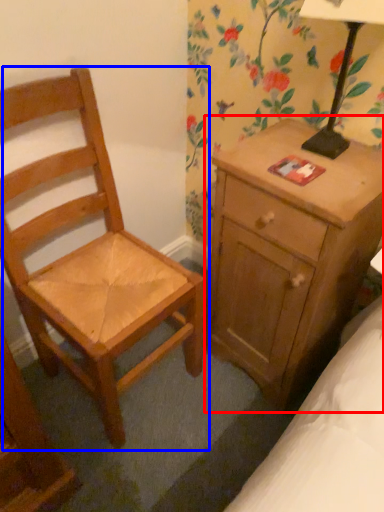
Question: Among these objects, which one is nearest to the camera, nightstand (highlighted by a red box) or chair (highlighted by a blue box)?

Choices:
 (A) nightstand
 (B) chair

Answer: (B)